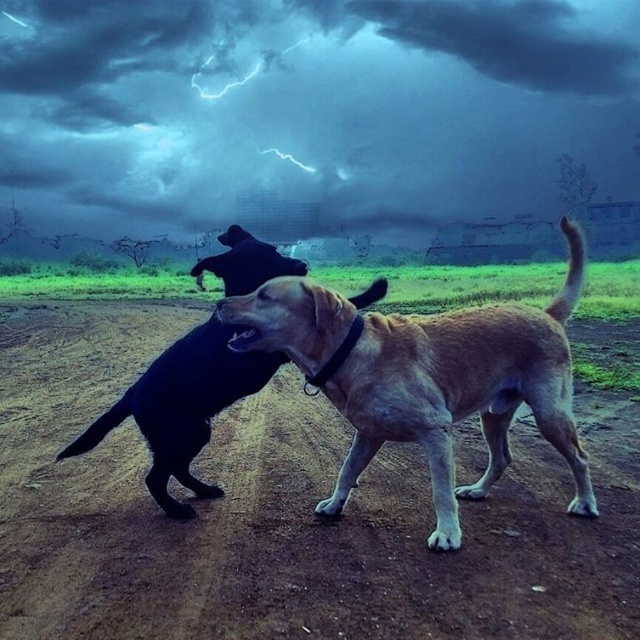
Consider the image. You are a photographer trying to capture a photo of the light brown fur dog at center without the dark cloudy sky at upper center taking up too much of the frame. Based on their sizes, can you adjust your camera angle to focus more on the dog?

The dark cloudy sky at upper center is larger in size than the light brown fur dog at center, so adjusting the camera angle to zoom in or frame the shot lower might help reduce the sky and focus more on the dog.